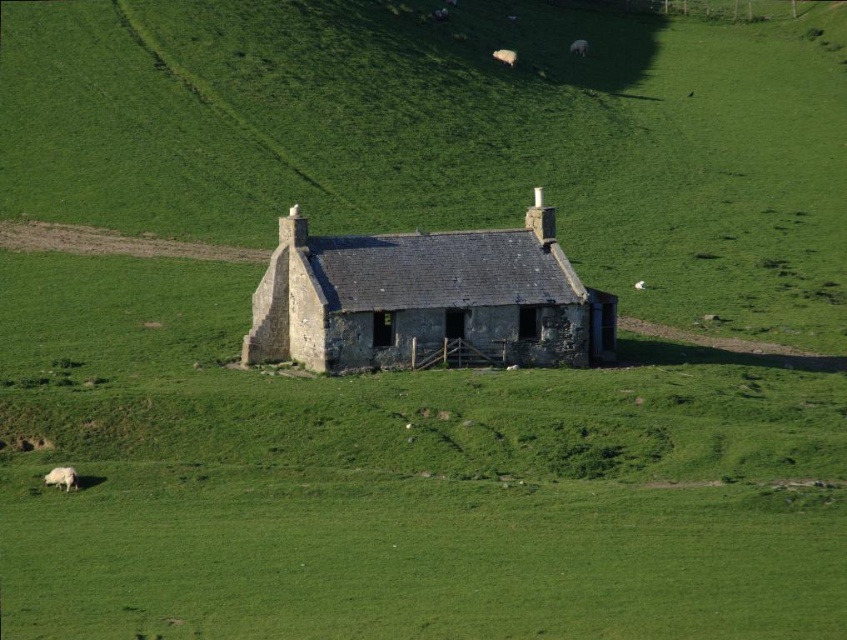
You are a farmer who wants to herd your sheep into the barn located at the lower right corner of the field. You see two white woolly sheep at upper center and white woolly sheep at center. Which sheep is closer to the barn?

The white woolly sheep at center is closer to the barn located at the lower right corner of the field than the white woolly sheep at upper center because the distance between them is 11.25 meters.

You are standing in the field looking at the cottage. There are two points marked on the ground near the cottage. The first point is at coordinates point (507, 51) and the second is at point (585, 42). Which point is closer to you?

Point (507, 51) is closer to the camera than point (585, 42), so the first point is closer to you.